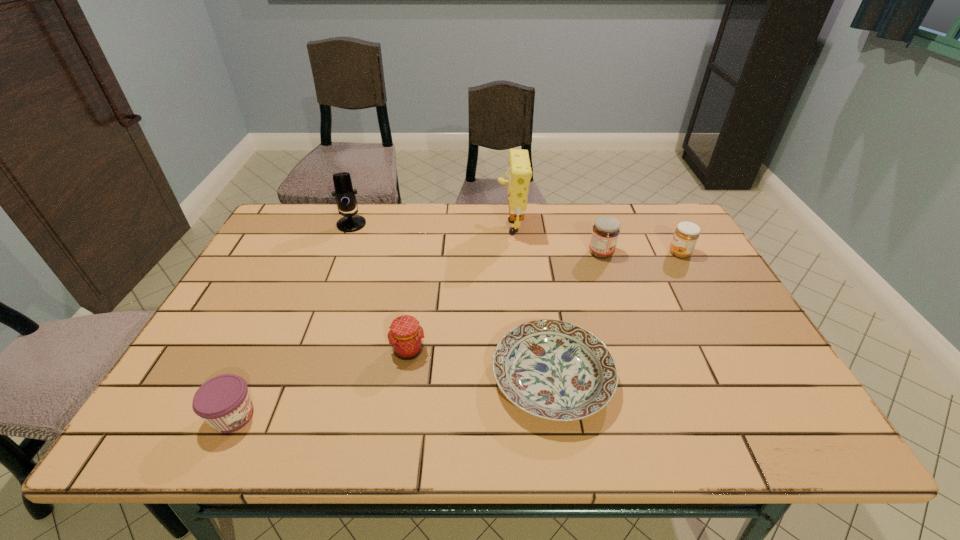
This screenshot has width=960, height=540. I want to click on microphone that is positioned at the far edge, so click(344, 194).

Identify the location of jam that is positioned at the far edge. (605, 232).

Where is `jam present at the near edge`? The image size is (960, 540). jam present at the near edge is located at coordinates (223, 401).

This screenshot has height=540, width=960. Find the location of `plate at the near edge`. plate at the near edge is located at coordinates (555, 370).

Where is `object that is at the left edge`? object that is at the left edge is located at coordinates [223, 401].

Identify the location of object present at the right edge. (685, 237).

You are a GUI agent. You are given a task and a screenshot of the screen. Output one action in this format:
    pyautogui.click(x=<x>, y=<y>)
    Task: Click on the object that is at the near left corner
    The image size is (960, 540).
    Given the screenshot: What is the action you would take?
    pyautogui.click(x=223, y=401)

Where is `vacant space at the far edge of the desktop`? vacant space at the far edge of the desktop is located at coordinates (392, 214).

Where is `vacant space at the left edge`? vacant space at the left edge is located at coordinates (260, 305).

In order to click on free space at the right edge in this screenshot , I will do `click(701, 261)`.